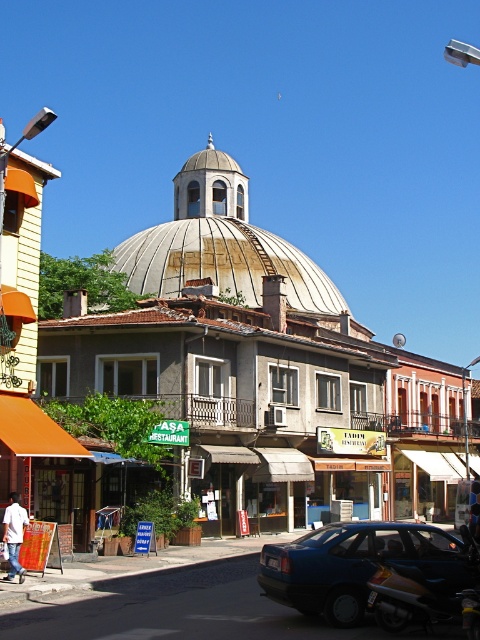
You are standing on the street and want to take a photo of the white textured dome at center and the shiny chrome motorcycle at lower right. Which object should you focus on first to ensure both are in the frame?

You should focus on the white textured dome at center first because it is closer to you than the shiny chrome motorcycle at lower right, ensuring both are in the frame.

You are driving a car and want to park in front of the rusty metal dome at center. However, there is a blue matte sedan at lower right blocking the way. Based on their positions, can you estimate whether the sedan is parked to the left or right side of the dome?

The blue matte sedan at lower right is parked to the right of the rusty metal dome at center because the dome is positioned to the left of the sedan.